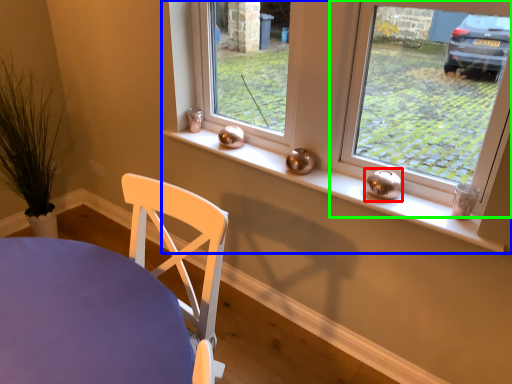
Question: Based on their relative distances, which object is farther from candle holder (highlighted by a red box)? Choose from window (highlighted by a blue box) and window (highlighted by a green box).

Choices:
 (A) window
 (B) window

Answer: (B)